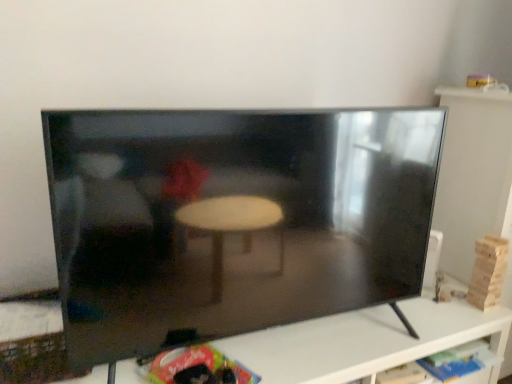
Where is `black glossy tv at center`? black glossy tv at center is located at coordinates (233, 220).

The height and width of the screenshot is (384, 512). What do you see at coordinates (233, 220) in the screenshot?
I see `black glossy tv at center` at bounding box center [233, 220].

In order to face black glossy tv at center, should I rotate leftwards or rightwards?

Turn right approximately 5.181 degrees to face it.

You are a GUI agent. You are given a task and a screenshot of the screen. Output one action in this format:
    pyautogui.click(x=<x>, y=<y>)
    Task: Click on the black glossy tv at center
    This screenshot has width=512, height=384.
    Given the screenshot: What is the action you would take?
    pyautogui.click(x=367, y=342)

This screenshot has height=384, width=512. What do you see at coordinates (367, 342) in the screenshot? I see `black glossy tv at center` at bounding box center [367, 342].

You are a GUI agent. You are given a task and a screenshot of the screen. Output one action in this format:
    pyautogui.click(x=<x>, y=<y>)
    Task: Click on the black glossy tv at center
    This screenshot has width=512, height=384.
    Given the screenshot: What is the action you would take?
    pyautogui.click(x=233, y=220)

Between black glossy tv at center and black glossy tv at center, which one appears on the left side from the viewer's perspective?

Positioned to the left is black glossy tv at center.

Is black glossy tv at center closer to the viewer compared to black glossy tv at center?

Yes, it is.

Which is farther from the camera, (324, 135) or (292, 374)?

Point (292, 374)

From the image's perspective, does black glossy tv at center appear lower than black glossy tv at center?

Incorrect, from the image's perspective, black glossy tv at center is higher than black glossy tv at center.

From a real-world perspective, which object rests below the other?

black glossy tv at center, from a real-world perspective.

Looking at their sizes, would you say black glossy tv at center is wider or thinner than black glossy tv at center?

Clearly, black glossy tv at center has less width compared to black glossy tv at center.

Can you confirm if black glossy tv at center is taller than black glossy tv at center?

Correct, black glossy tv at center is much taller as black glossy tv at center.

Between black glossy tv at center and black glossy tv at center, which one has smaller size?

black glossy tv at center is smaller.

Is black glossy tv at center spatially inside black glossy tv at center, or outside of it?

black glossy tv at center is spatially situated outside black glossy tv at center.

Is black glossy tv at center far from black glossy tv at center?

No.

Could you tell me if black glossy tv at center is turned towards black glossy tv at center?

No, black glossy tv at center is not turned towards black glossy tv at center.

Looking at this image, measure the distance between black glossy tv at center and black glossy tv at center.

black glossy tv at center is 34.55 centimeters away from black glossy tv at center.

Where is `television above the black glossy tv at center (from a real-world perspective)`? Image resolution: width=512 pixels, height=384 pixels. television above the black glossy tv at center (from a real-world perspective) is located at coordinates (233, 220).

Is black glossy tv at center at the left side of black glossy tv at center?

Incorrect, black glossy tv at center is not on the left side of black glossy tv at center.

Relative to black glossy tv at center, is black glossy tv at center in front or behind?

Clearly, black glossy tv at center is behind black glossy tv at center.

Which is behind, point (343, 382) or point (149, 238)?

Point (343, 382)

From the image's perspective, between black glossy tv at center and black glossy tv at center, who is located below?

black glossy tv at center, from the image's perspective.

From the picture: From a real-world perspective, is black glossy tv at center on top of black glossy tv at center?

No, from a real-world perspective, black glossy tv at center is not over black glossy tv at center

Considering the relative sizes of black glossy tv at center and black glossy tv at center in the image provided, is black glossy tv at center thinner than black glossy tv at center?

Incorrect, the width of black glossy tv at center is not less than that of black glossy tv at center.

Between black glossy tv at center and black glossy tv at center, which one has less height?

With less height is black glossy tv at center.

Between black glossy tv at center and black glossy tv at center, which one has smaller size?

Smaller between the two is black glossy tv at center.

Is black glossy tv at center situated inside black glossy tv at center or outside?

black glossy tv at center lies outside black glossy tv at center.

Are black glossy tv at center and black glossy tv at center far apart?

Actually, black glossy tv at center and black glossy tv at center are a little close together.

Is black glossy tv at center oriented towards black glossy tv at center?

No, black glossy tv at center does not turn towards black glossy tv at center.

What's the angular difference between black glossy tv at center and black glossy tv at center's facing directions?

0.000401 degrees separate the facing orientations of black glossy tv at center and black glossy tv at center.

How much distance is there between black glossy tv at center and black glossy tv at center?

34.55 centimeters.

Where is `furniture to the right of black glossy tv at center`? The width and height of the screenshot is (512, 384). furniture to the right of black glossy tv at center is located at coordinates (367, 342).

In order to click on furniture behind the black glossy tv at center in this screenshot , I will do `click(367, 342)`.

This screenshot has height=384, width=512. What are the coordinates of `television above the black glossy tv at center (from the image's perspective)` in the screenshot? It's located at (233, 220).